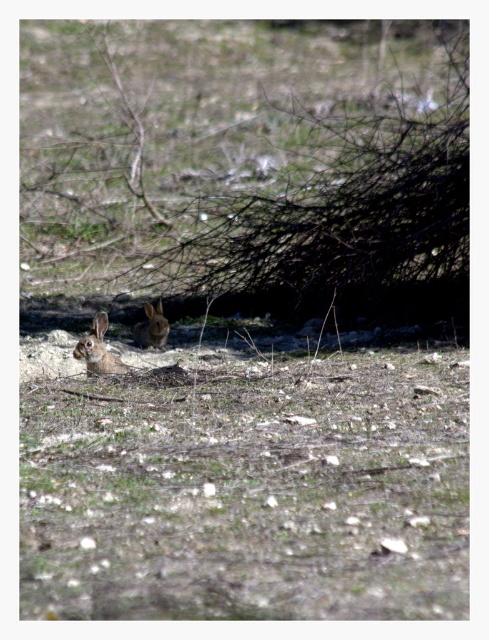
Who is taller, brown textured tree at center or brown furry rabbit at center?

Standing taller between the two is brown textured tree at center.

You are a GUI agent. You are given a task and a screenshot of the screen. Output one action in this format:
    pyautogui.click(x=<x>, y=<y>)
    Task: Click on the brown textured tree at center
    
    Given the screenshot: What is the action you would take?
    pyautogui.click(x=259, y=180)

At what (x,y) coordinates should I click in order to perform the action: click on brown textured tree at center. Please return your answer as a coordinate pair (x, y). The height and width of the screenshot is (640, 489). Looking at the image, I should click on (259, 180).

From the picture: Does furry brown rabbit at lower left have a greater width compared to brown furry rabbit at center?

Indeed, furry brown rabbit at lower left has a greater width compared to brown furry rabbit at center.

Which is above, furry brown rabbit at lower left or brown furry rabbit at center?

brown furry rabbit at center is higher up.

Which is behind, point (87, 353) or point (167, 333)?

Point (167, 333)

The image size is (489, 640). I want to click on furry brown rabbit at lower left, so click(x=97, y=349).

Based on the photo, which is more to the right, brown grass at lower center or furry brown rabbit at lower left?

brown grass at lower center is more to the right.

Can you confirm if brown grass at lower center is thinner than furry brown rabbit at lower left?

Incorrect, brown grass at lower center's width is not less than furry brown rabbit at lower left's.

Does point (409, 435) lie behind point (110, 358)?

No, (409, 435) is closer to viewer.

Image resolution: width=489 pixels, height=640 pixels. What are the coordinates of `brown grass at lower center` in the screenshot? It's located at (249, 492).